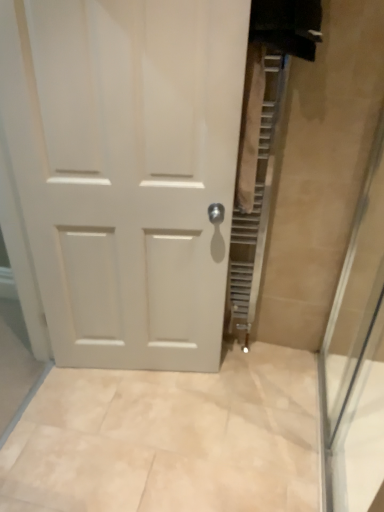
Where is `spots to the right of white matte door at center`? spots to the right of white matte door at center is located at coordinates click(248, 397).